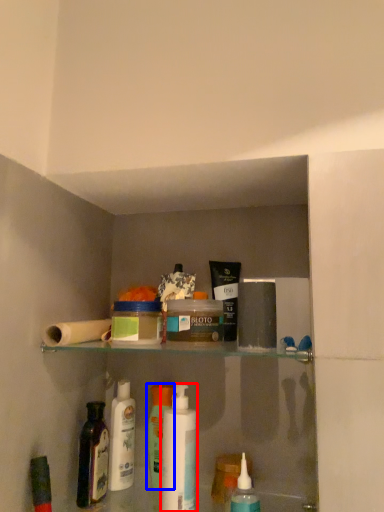
Question: Which object appears closest to the camera in this image, mouthwash (highlighted by a red box) or toiletry (highlighted by a blue box)?

Choices:
 (A) mouthwash
 (B) toiletry

Answer: (A)